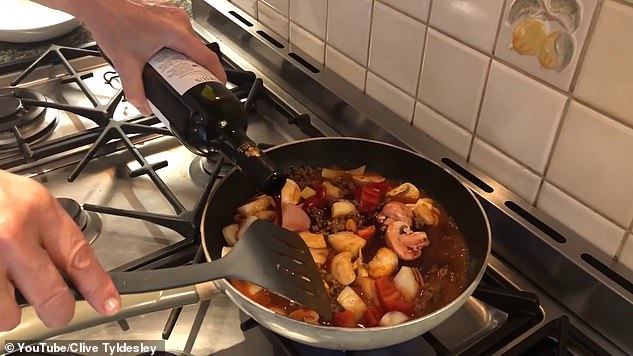
Where is `silver metallic pan`? The image size is (633, 356). silver metallic pan is located at coordinates (354, 339).